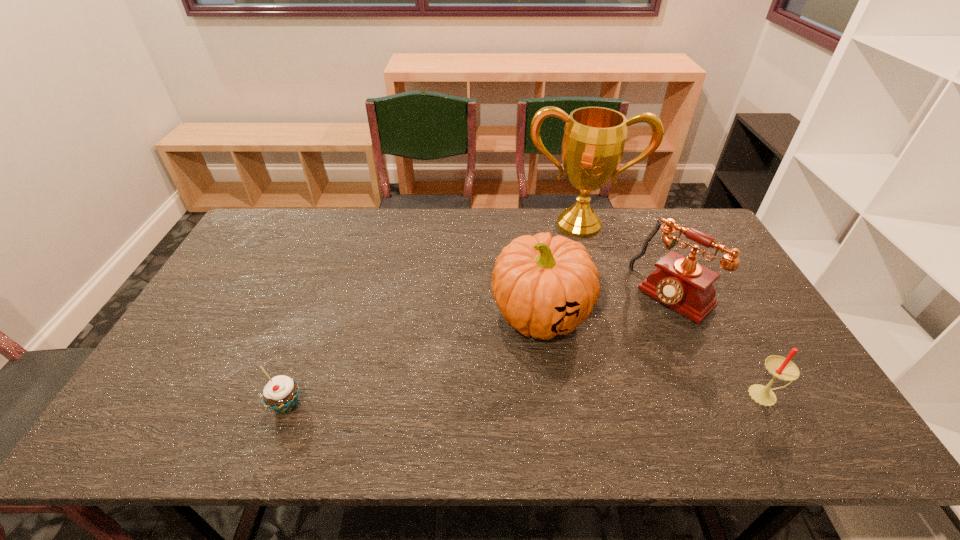
Find the location of a particular element. free space that satisfies the following two spatial constraints: 1. on the back side of the candle; 2. on the right side of the cupcake is located at coordinates (290, 395).

Where is `free location that satisfies the following two spatial constraints: 1. on the back side of the second shortest object; 2. on the right side of the leftmost object`? This screenshot has width=960, height=540. free location that satisfies the following two spatial constraints: 1. on the back side of the second shortest object; 2. on the right side of the leftmost object is located at coordinates (290, 395).

The image size is (960, 540). I want to click on vacant position in the image that satisfies the following two spatial constraints: 1. on the back side of the pumpkin; 2. on the left side of the farthest object, so click(528, 224).